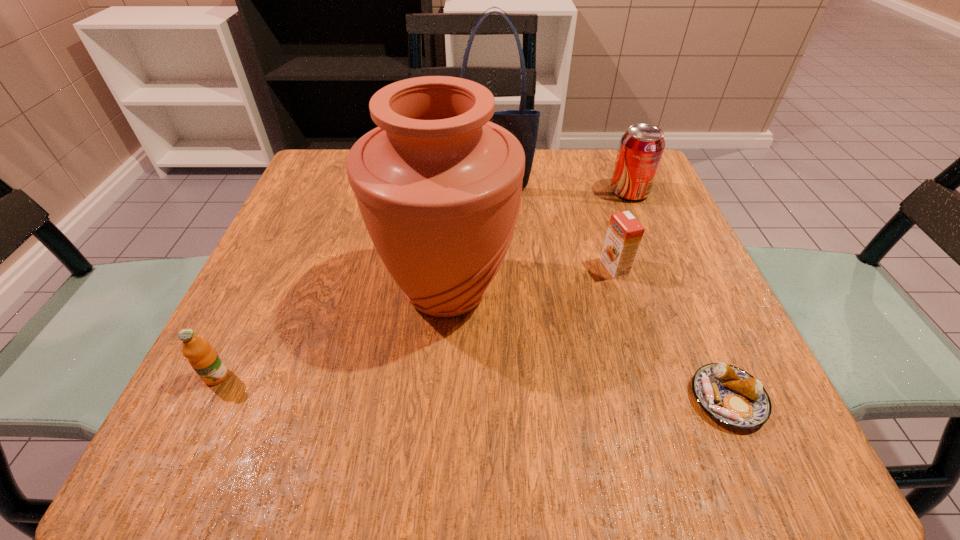
Where is `vacant space that is in between the pastry and the fourth shortest object`? Image resolution: width=960 pixels, height=540 pixels. vacant space that is in between the pastry and the fourth shortest object is located at coordinates (679, 295).

The height and width of the screenshot is (540, 960). Find the location of `vacant area between the fourth shortest object and the shopping bag`. vacant area between the fourth shortest object and the shopping bag is located at coordinates (561, 191).

Locate an element on the screen. The width and height of the screenshot is (960, 540). free space between the fourth shortest object and the shopping bag is located at coordinates (561, 191).

Find the location of a particular element. This screenshot has width=960, height=540. vacant space in between the pastry and the shopping bag is located at coordinates (610, 294).

Identify the location of empty location between the farther orange juice and the vase. The image size is (960, 540). (531, 279).

Find the location of a particular element. This screenshot has height=540, width=960. vacant space that is in between the shortest object and the left orange juice is located at coordinates (472, 388).

Locate an element on the screen. unoccupied position between the vase and the left orange juice is located at coordinates (331, 333).

In order to click on vacant space in between the right orange juice and the shopping bag in this screenshot , I will do `click(553, 228)`.

Identify the location of free space between the third object from right to left and the vase. The width and height of the screenshot is (960, 540). (x=531, y=279).

This screenshot has height=540, width=960. I want to click on unoccupied area between the leftmost object and the vase, so click(331, 333).